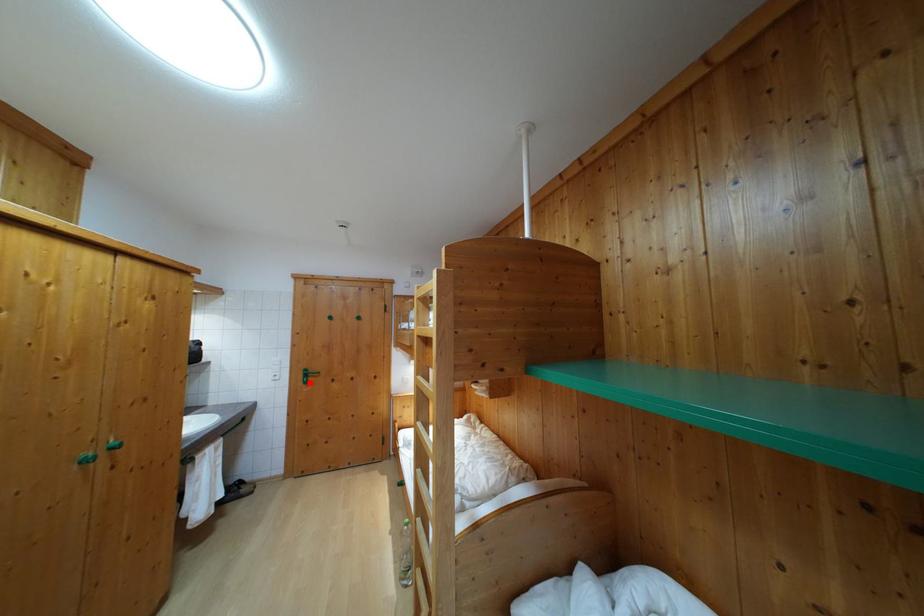
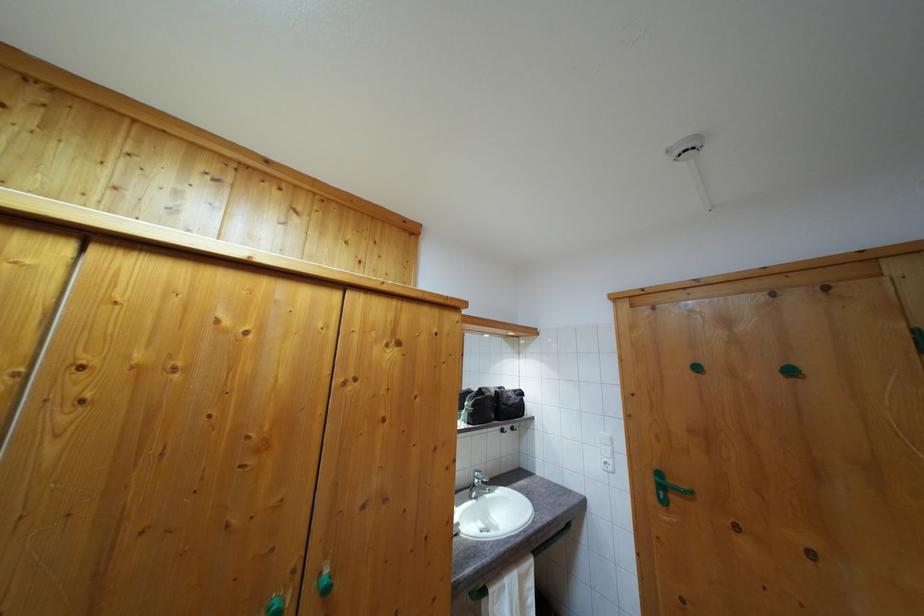
In the second image, find the point that corresponds to the highlighted location in the first image.

(664, 493)